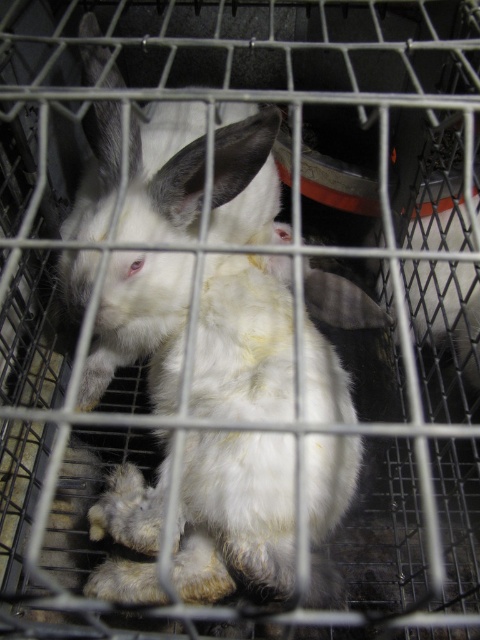
You are a veterinarian examining an image of two rabbits in a cage. You see the white fluffy rabbit at center and the white fur rabbit at center. Which rabbit is sitting directly above the other?

The white fluffy rabbit at center is positioned under the white fur rabbit at center, so the white fur rabbit at center is sitting directly above the white fluffy rabbit at center.

You are a pet sitter who needs to clean the cage of the white fluffy rabbit at center. The cleaning tools are placed 24 inches away from you. Can you reach them without moving your position?

The white fluffy rabbit at center is 21.33 inches from viewer, so the distance between you and the rabbit is 21.33 inches. Since the cleaning tools are 24 inches away from you, which is farther than the rabbit, you can reach them without moving your position as long as there is a clear path.